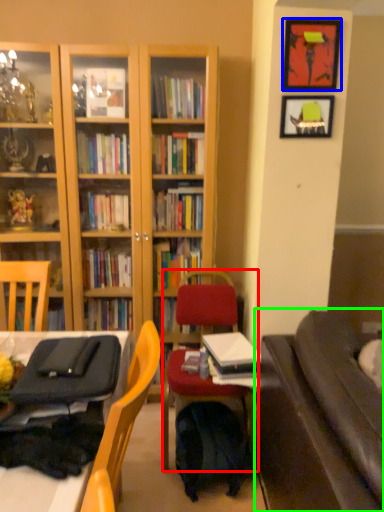
Question: Which object is the closest to the chair (highlighted by a red box)? Choose among these: picture frame (highlighted by a blue box) or studio couch (highlighted by a green box).

Choices:
 (A) picture frame
 (B) studio couch

Answer: (B)